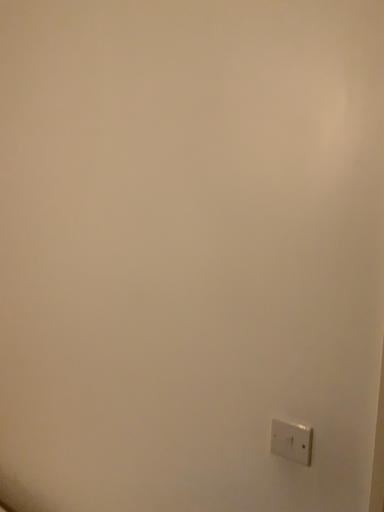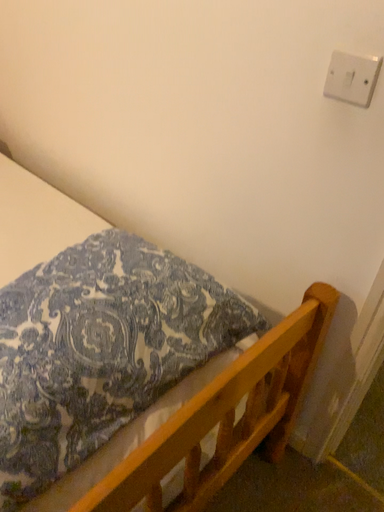
Question: How did the camera likely rotate when shooting the video?

Choices:
 (A) rotated downward
 (B) rotated upward

Answer: (A)